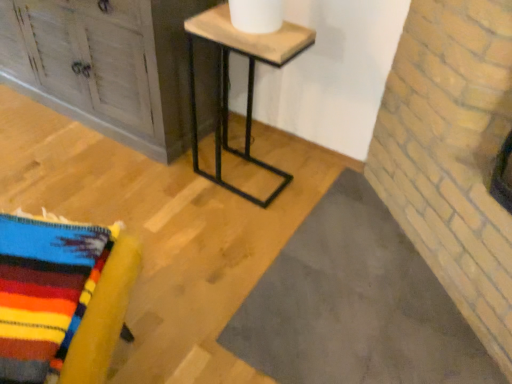
Find the location of `wooden/marble table at center`. wooden/marble table at center is located at coordinates (248, 82).

Which object is positioned more to the left, knitted wool blanket at lower left, which is the second furniture in back-to-front order, or distressed wood cabinet at upper left, arranged as the first furniture when viewed from the top?

distressed wood cabinet at upper left, arranged as the first furniture when viewed from the top.

Is knitted wool blanket at lower left, positioned as the second furniture in top-to-bottom order, looking in the opposite direction of distressed wood cabinet at upper left, arranged as the first furniture when viewed from the top?

No, knitted wool blanket at lower left, positioned as the second furniture in top-to-bottom order,'s orientation is not away from distressed wood cabinet at upper left, arranged as the first furniture when viewed from the top.

Is distressed wood cabinet at upper left, which is the second furniture from front to back, surrounded by knitted wool blanket at lower left, which ranks as the 1th furniture in front-to-back order?

That's incorrect, distressed wood cabinet at upper left, which is the second furniture from front to back, is not inside knitted wool blanket at lower left, which ranks as the 1th furniture in front-to-back order.

Looking at the image, does wooden/marble table at center seem bigger or smaller compared to distressed wood cabinet at upper left, which is the second furniture from front to back?

Clearly, wooden/marble table at center is smaller in size than distressed wood cabinet at upper left, which is the second furniture from front to back.

Looking at this image, what's the angular difference between wooden/marble table at center and distressed wood cabinet at upper left, arranged as the first furniture when viewed from the top,'s facing directions?

The angular difference between wooden/marble table at center and distressed wood cabinet at upper left, arranged as the first furniture when viewed from the top, is 1.25 degrees.

Can you confirm if wooden/marble table at center is wider than distressed wood cabinet at upper left, which is the first furniture from back to front?

Incorrect, the width of wooden/marble table at center does not surpass that of distressed wood cabinet at upper left, which is the first furniture from back to front.

Is wooden/marble table at center looking in the opposite direction of distressed wood cabinet at upper left, which is the second furniture from front to back?

No, distressed wood cabinet at upper left, which is the second furniture from front to back, is not at the back of wooden/marble table at center.

Is knitted wool blanket at lower left, positioned as the second furniture in top-to-bottom order, beside wooden/marble table at center?

No, knitted wool blanket at lower left, positioned as the second furniture in top-to-bottom order, is not next to wooden/marble table at center.

Is knitted wool blanket at lower left, positioned as the second furniture in top-to-bottom order, at the right side of wooden/marble table at center?

In fact, knitted wool blanket at lower left, positioned as the second furniture in top-to-bottom order, is to the left of wooden/marble table at center.

Based on the photo, from the image's perspective, is knitted wool blanket at lower left, which ranks as the first furniture in bottom-to-top order, on top of wooden/marble table at center?

No, from the image's perspective, knitted wool blanket at lower left, which ranks as the first furniture in bottom-to-top order, is not over wooden/marble table at center.

Between distressed wood cabinet at upper left, which is the second furniture from front to back, and wooden/marble table at center, which one has less height?

With less height is wooden/marble table at center.

Is distressed wood cabinet at upper left, arranged as the first furniture when viewed from the top, placed right next to wooden/marble table at center?

They are not placed beside each other.

Considering the positions of objects distressed wood cabinet at upper left, the 2th furniture positioned from the bottom, and wooden/marble table at center in the image provided, who is more to the left, distressed wood cabinet at upper left, the 2th furniture positioned from the bottom, or wooden/marble table at center?

distressed wood cabinet at upper left, the 2th furniture positioned from the bottom, is more to the left.

Between wooden/marble table at center and knitted wool blanket at lower left, which is the second furniture in back-to-front order, which one has larger size?

With larger size is wooden/marble table at center.

Considering the positions of objects wooden/marble table at center and knitted wool blanket at lower left, which ranks as the first furniture in bottom-to-top order, in the image provided, who is more to the left, wooden/marble table at center or knitted wool blanket at lower left, which ranks as the first furniture in bottom-to-top order,?

knitted wool blanket at lower left, which ranks as the first furniture in bottom-to-top order.

Based on the photo, is wooden/marble table at center positioned with its back to knitted wool blanket at lower left, which ranks as the 1th furniture in front-to-back order?

No.

How much distance is there between wooden/marble table at center and knitted wool blanket at lower left, which ranks as the 1th furniture in front-to-back order?

37.75 inches.

Is distressed wood cabinet at upper left, arranged as the first furniture when viewed from the top, facing away from knitted wool blanket at lower left, which is the second furniture in back-to-front order?

distressed wood cabinet at upper left, arranged as the first furniture when viewed from the top, does not have its back to knitted wool blanket at lower left, which is the second furniture in back-to-front order.

From a real-world perspective, relative to knitted wool blanket at lower left, which ranks as the 1th furniture in front-to-back order, is distressed wood cabinet at upper left, arranged as the first furniture when viewed from the top, vertically above or below?

In terms of real-world spatial position, distressed wood cabinet at upper left, arranged as the first furniture when viewed from the top, is above knitted wool blanket at lower left, which ranks as the 1th furniture in front-to-back order.

From the image's perspective, between distressed wood cabinet at upper left, arranged as the first furniture when viewed from the top, and knitted wool blanket at lower left, which is the second furniture in back-to-front order, which one is located above?

distressed wood cabinet at upper left, arranged as the first furniture when viewed from the top, is shown above in the image.

Which object is wider, distressed wood cabinet at upper left, the 2th furniture positioned from the bottom, or knitted wool blanket at lower left, which ranks as the 1th furniture in front-to-back order?

distressed wood cabinet at upper left, the 2th furniture positioned from the bottom.

The image size is (512, 384). I want to click on furniture behind the knitted wool blanket at lower left, which ranks as the 1th furniture in front-to-back order, so click(x=105, y=65).

At what (x,y) coordinates should I click in order to perform the action: click on table below the distressed wood cabinet at upper left, which is the second furniture from front to back (from a real-world perspective). Please return your answer as a coordinate pair (x, y). Looking at the image, I should click on (248, 82).

Considering their positions, is distressed wood cabinet at upper left, which is the second furniture from front to back, positioned further to knitted wool blanket at lower left, which is the second furniture in back-to-front order, than wooden/marble table at center?

distressed wood cabinet at upper left, which is the second furniture from front to back, lies further to knitted wool blanket at lower left, which is the second furniture in back-to-front order, than the other object.

Considering their positions, is knitted wool blanket at lower left, which ranks as the first furniture in bottom-to-top order, positioned further to distressed wood cabinet at upper left, which is the second furniture from front to back, than wooden/marble table at center?

knitted wool blanket at lower left, which ranks as the first furniture in bottom-to-top order, lies further to distressed wood cabinet at upper left, which is the second furniture from front to back, than the other object.

Estimate the real-world distances between objects in this image. Which object is further from knitted wool blanket at lower left, positioned as the second furniture in top-to-bottom order, wooden/marble table at center or distressed wood cabinet at upper left, the 2th furniture positioned from the bottom?

distressed wood cabinet at upper left, the 2th furniture positioned from the bottom.

When comparing their distances from wooden/marble table at center, does distressed wood cabinet at upper left, which is the first furniture from back to front, or knitted wool blanket at lower left, positioned as the second furniture in top-to-bottom order, seem further?

knitted wool blanket at lower left, positioned as the second furniture in top-to-bottom order, is further to wooden/marble table at center.

Considering their positions, is wooden/marble table at center positioned closer to distressed wood cabinet at upper left, which is the first furniture from back to front, than knitted wool blanket at lower left, positioned as the second furniture in top-to-bottom order?

wooden/marble table at center.

Estimate the real-world distances between objects in this image. Which object is closer to wooden/marble table at center, knitted wool blanket at lower left, which is the second furniture in back-to-front order, or distressed wood cabinet at upper left, arranged as the first furniture when viewed from the top?

The object closer to wooden/marble table at center is distressed wood cabinet at upper left, arranged as the first furniture when viewed from the top.

Identify the location of table between distressed wood cabinet at upper left, which is the second furniture from front to back, and knitted wool blanket at lower left, which ranks as the first furniture in bottom-to-top order, in the up-down direction. The width and height of the screenshot is (512, 384). (248, 82).